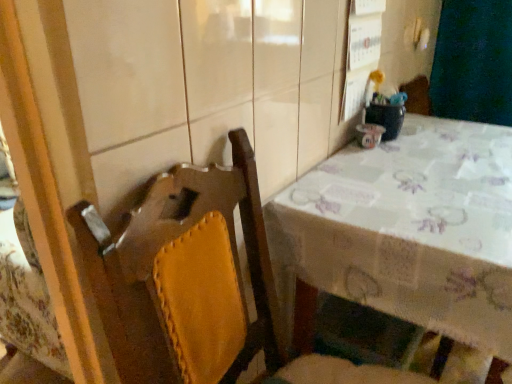
The image size is (512, 384). In order to click on white printed tablecloth at right in this screenshot , I will do `click(408, 230)`.

The height and width of the screenshot is (384, 512). Describe the element at coordinates (408, 230) in the screenshot. I see `white printed tablecloth at right` at that location.

This screenshot has width=512, height=384. In order to click on white printed tablecloth at right in this screenshot , I will do `click(408, 230)`.